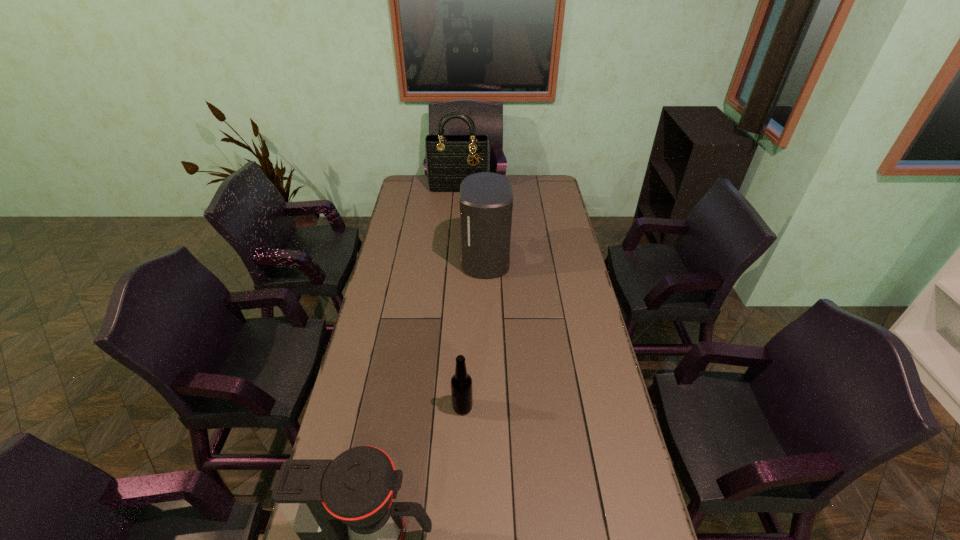
The height and width of the screenshot is (540, 960). I want to click on object that is at the far edge, so click(x=448, y=162).

In order to click on object that is at the left edge in this screenshot , I will do `click(448, 162)`.

Locate an element on the screen. object located at the far left corner is located at coordinates (448, 162).

Where is `free space at the left edge`? free space at the left edge is located at coordinates [x=408, y=339].

You are a GUI agent. You are given a task and a screenshot of the screen. Output one action in this format:
    pyautogui.click(x=<x>, y=<y>)
    Task: Click on the free spot at the right edge of the desktop
    Image resolution: width=960 pixels, height=540 pixels.
    Given the screenshot: What is the action you would take?
    pyautogui.click(x=553, y=227)

Where is `free space at the far left corner of the desktop`? free space at the far left corner of the desktop is located at coordinates (425, 179).

In order to click on free region at the far right corner in this screenshot , I will do `click(561, 192)`.

Find the location of `free point between the second nearest object and the second farthest object`. free point between the second nearest object and the second farthest object is located at coordinates (473, 333).

This screenshot has width=960, height=540. I want to click on vacant space in between the right coffee maker and the third farthest object, so click(x=473, y=333).

You are a GUI agent. You are given a task and a screenshot of the screen. Output one action in this format:
    pyautogui.click(x=<x>, y=<y>)
    Task: Click on the free space between the shortest object and the handbag
    The height and width of the screenshot is (540, 960).
    Given the screenshot: What is the action you would take?
    pyautogui.click(x=461, y=296)